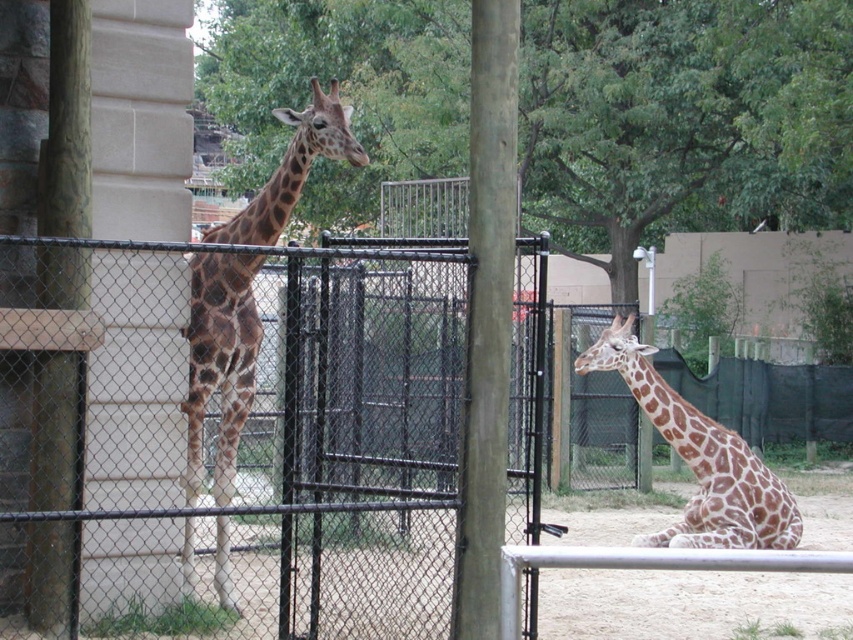
You are a zookeeper who needs to hang a banner on the smooth wood pole at center. The banner requires a height of 2 meters to be visible above the brown spotted giraffe at lower right. Is the pole tall enough?

The smooth wood pole at center has a greater height compared to the brown spotted giraffe at lower right. Since the pole is taller than the giraffe, it should be sufficient to hang the banner at 2 meters so that it remains visible above the brown spotted giraffe at lower right.